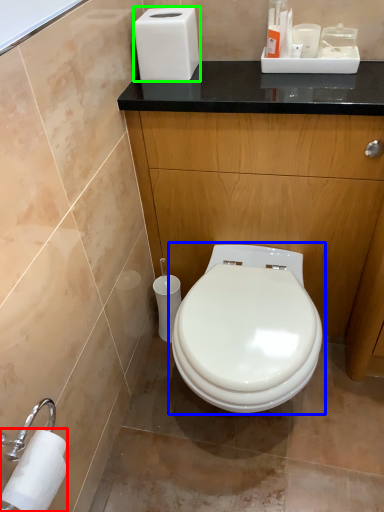
Question: Considering the real-world distances, which object is closest to toilet paper (highlighted by a red box)? toilet (highlighted by a blue box) or hand dryer (highlighted by a green box).

Choices:
 (A) toilet
 (B) hand dryer

Answer: (A)